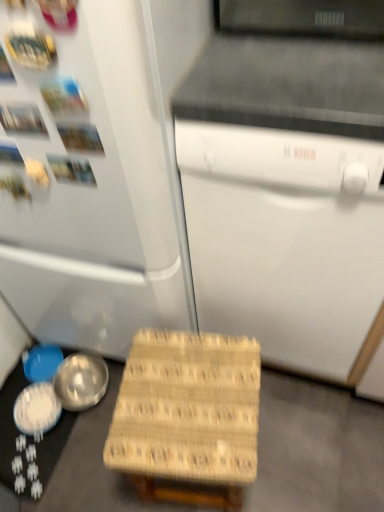
Question: Can you confirm if shiny silver bowl at lower left, the 2th bowl from the left, is shorter than woven wood step stool at lower center?

Choices:
 (A) no
 (B) yes

Answer: (B)

Question: Is shiny silver bowl at lower left, the 2th bowl from the left, next to woven wood step stool at lower center and touching it?

Choices:
 (A) yes
 (B) no

Answer: (B)

Question: Could you tell me if shiny silver bowl at lower left, the 2th bowl from the left, is facing woven wood step stool at lower center?

Choices:
 (A) no
 (B) yes

Answer: (B)

Question: Is woven wood step stool at lower center a part of shiny silver bowl at lower left, positioned as the 2th bowl in right-to-left order?

Choices:
 (A) no
 (B) yes

Answer: (A)

Question: Is woven wood step stool at lower center at the back of shiny silver bowl at lower left, the 2th bowl from the left?

Choices:
 (A) no
 (B) yes

Answer: (A)

Question: Is white matte refrigerator at left looking in the opposite direction of shiny silver bowl at lower left, positioned as the 2th bowl in right-to-left order?

Choices:
 (A) yes
 (B) no

Answer: (B)

Question: From the image's perspective, would you say white matte refrigerator at left is positioned over shiny silver bowl at lower left, the 2th bowl from the left?

Choices:
 (A) no
 (B) yes

Answer: (B)

Question: Is white matte refrigerator at left bigger than shiny silver bowl at lower left, positioned as the 2th bowl in right-to-left order?

Choices:
 (A) no
 (B) yes

Answer: (B)

Question: Is white matte refrigerator at left at the left side of shiny silver bowl at lower left, positioned as the 2th bowl in right-to-left order?

Choices:
 (A) no
 (B) yes

Answer: (A)

Question: Does white matte refrigerator at left have a greater height compared to shiny silver bowl at lower left, positioned as the 2th bowl in right-to-left order?

Choices:
 (A) no
 (B) yes

Answer: (B)

Question: Is white matte refrigerator at left facing towards shiny silver bowl at lower left, the 2th bowl from the left?

Choices:
 (A) yes
 (B) no

Answer: (A)

Question: Is white matte refrigerator at left bigger than shiny metallic bowl at lower left, which is the 1th bowl from right to left?

Choices:
 (A) no
 (B) yes

Answer: (B)